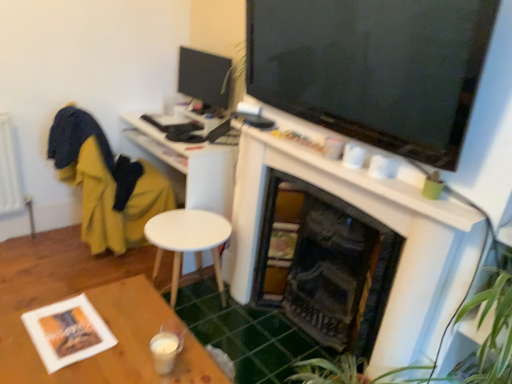
Describe the element at coordinates (114, 346) in the screenshot. Image resolution: width=512 pixels, height=384 pixels. I see `wooden table at lower left` at that location.

The width and height of the screenshot is (512, 384). I want to click on wooden table at lower left, so click(x=114, y=346).

You are a GUI agent. You are given a task and a screenshot of the screen. Output one action in this format:
    pyautogui.click(x=<x>, y=<y>)
    Task: Click on the white matte round table at center
    This screenshot has height=384, width=512.
    Given the screenshot: What is the action you would take?
    pyautogui.click(x=188, y=241)

Image resolution: width=512 pixels, height=384 pixels. Identify the location of white matte fireplace at upper center. (371, 216).

Considering the sizes of objects matte black monitor at upper left and yellow fabric swivel chair at left in the image provided, who is thinner, matte black monitor at upper left or yellow fabric swivel chair at left?

matte black monitor at upper left is thinner.

From the image's perspective, which is above, matte black monitor at upper left or yellow fabric swivel chair at left?

matte black monitor at upper left appears higher in the image.

Is the surface of matte black monitor at upper left in direct contact with yellow fabric swivel chair at left?

No, matte black monitor at upper left is not touching yellow fabric swivel chair at left.

Which is more to the left, matte black monitor at upper left or yellow fabric swivel chair at left?

yellow fabric swivel chair at left is more to the left.

Considering the relative sizes of white matte round table at center and white matte fireplace at upper center in the image provided, is white matte round table at center thinner than white matte fireplace at upper center?

In fact, white matte round table at center might be wider than white matte fireplace at upper center.

Does white matte round table at center have a smaller size compared to white matte fireplace at upper center?

Correct, white matte round table at center occupies less space than white matte fireplace at upper center.

In the image, is white matte round table at center positioned in front of or behind white matte fireplace at upper center?

In the image, white matte round table at center appears behind white matte fireplace at upper center.

Based on the photo, considering the relative sizes of white matte round table at center and white matte fireplace at upper center in the image provided, is white matte round table at center taller than white matte fireplace at upper center?

No, white matte round table at center is not taller than white matte fireplace at upper center.

From a real-world perspective, between wooden table at lower left and white matte desk at center, who is vertically lower?

wooden table at lower left, from a real-world perspective.

Is wooden table at lower left bigger than white matte desk at center?

Incorrect, wooden table at lower left is not larger than white matte desk at center.

How distant is wooden table at lower left from white matte desk at center?

wooden table at lower left is 3.63 feet from white matte desk at center.

Based on the photo, is white matte round table at center completely or partially outside of wooden table at lower left?

Yes, white matte round table at center is outside of wooden table at lower left.

Is white matte round table at center closer to camera compared to wooden table at lower left?

No, it is not.

Which of these two, white matte round table at center or wooden table at lower left, stands shorter?

white matte round table at center.

Which object is wider, white matte round table at center or wooden table at lower left?

Wider between the two is wooden table at lower left.

Is white matte round table at center not within green leafy plant at lower right?

white matte round table at center is positioned outside green leafy plant at lower right.

Does white matte round table at center have a lesser height compared to green leafy plant at lower right?

Correct, white matte round table at center is not as tall as green leafy plant at lower right.

Is matte black monitor at upper left aimed at white matte desk at center?

No, matte black monitor at upper left is not aimed at white matte desk at center.

Is matte black monitor at upper left at the right side of white matte desk at center?

Yes, matte black monitor at upper left is to the right of white matte desk at center.

Looking at this image, which is less distant, (191, 88) or (222, 150)?

The point (222, 150) is closer.

Looking at their sizes, would you say matte black monitor at upper left is wider or thinner than white matte desk at center?

In the image, matte black monitor at upper left appears to be more narrow than white matte desk at center.

From a real-world perspective, is wooden table at lower left below yellow fabric swivel chair at left?

Indeed, from a real-world perspective, wooden table at lower left is positioned beneath yellow fabric swivel chair at left.

Based on the photo, could you tell me if wooden table at lower left is turned towards yellow fabric swivel chair at left?

No.

The height and width of the screenshot is (384, 512). I want to click on table below the yellow fabric swivel chair at left (from the image's perspective), so click(x=114, y=346).

Is wooden table at lower left to the left of yellow fabric swivel chair at left from the viewer's perspective?

No, wooden table at lower left is not to the left of yellow fabric swivel chair at left.

Identify the location of tv show on the right of yellow fabric swivel chair at left. This screenshot has width=512, height=384. (205, 77).

You are a GUI agent. You are given a task and a screenshot of the screen. Output one action in this format:
    pyautogui.click(x=<x>, y=<y>)
    Task: Click on the fireplace in front of the white matte round table at center
    This screenshot has height=384, width=512.
    Given the screenshot: What is the action you would take?
    pyautogui.click(x=371, y=216)

Based on their spatial positions, is white matte round table at center or white matte fireplace at upper center closer to white matte desk at center?

white matte round table at center.

When comparing their distances from white matte fireplace at upper center, does wooden table at lower left or green leafy plant at lower right seem further?

Based on the image, wooden table at lower left appears to be further to white matte fireplace at upper center.

Based on the photo, estimate the real-world distances between objects in this image. Which object is closer to green leafy plant at lower right, yellow fabric swivel chair at left or white matte round table at center?

white matte round table at center is closer to green leafy plant at lower right.

Based on their spatial positions, is white matte fireplace at upper center or green leafy plant at lower right further from white matte desk at center?

green leafy plant at lower right is positioned further to the anchor white matte desk at center.

In the scene shown: Which object lies further to the anchor point white matte desk at center, white matte round table at center or matte black monitor at upper left?

matte black monitor at upper left.

Looking at the image, which one is located closer to wooden table at lower left, green leafy plant at lower right or white matte desk at center?

The object closer to wooden table at lower left is green leafy plant at lower right.

Based on the photo, based on their spatial positions, is wooden table at lower left or yellow fabric swivel chair at left further from white matte desk at center?

wooden table at lower left lies further to white matte desk at center than the other object.

From the image, which object appears to be nearer to white matte desk at center, white matte fireplace at upper center or matte black monitor at upper left?

matte black monitor at upper left.

You are a GUI agent. You are given a task and a screenshot of the screen. Output one action in this format:
    pyautogui.click(x=<x>, y=<y>)
    Task: Click on the desk between yellow fabric swivel chair at left and white matte fireplace at upper center in the horizontal direction
    Image resolution: width=512 pixels, height=384 pixels.
    Given the screenshot: What is the action you would take?
    pyautogui.click(x=188, y=166)

In order to click on fireplace located between green leafy plant at lower right and matte black monitor at upper left in the depth direction in this screenshot , I will do `click(371, 216)`.

The height and width of the screenshot is (384, 512). In order to click on round table located between green leafy plant at lower right and matte black monitor at upper left in the depth direction in this screenshot , I will do `click(188, 241)`.

At what (x,y) coordinates should I click in order to perform the action: click on fireplace located between wooden table at lower left and green leafy plant at lower right in the left-right direction. Please return your answer as a coordinate pair (x, y). The image size is (512, 384). Looking at the image, I should click on (371, 216).